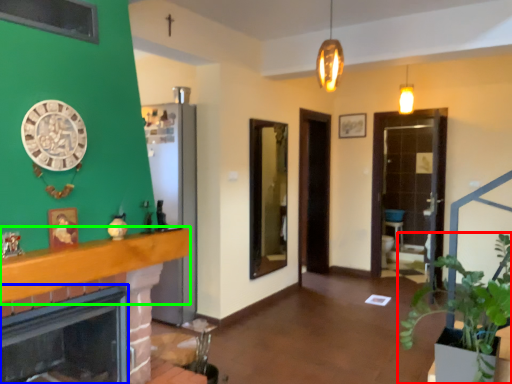
Question: Which is nearer to the houseplant (highlighted by a red box)? fireplace (highlighted by a blue box) or balustrade (highlighted by a green box).

Choices:
 (A) fireplace
 (B) balustrade

Answer: (B)